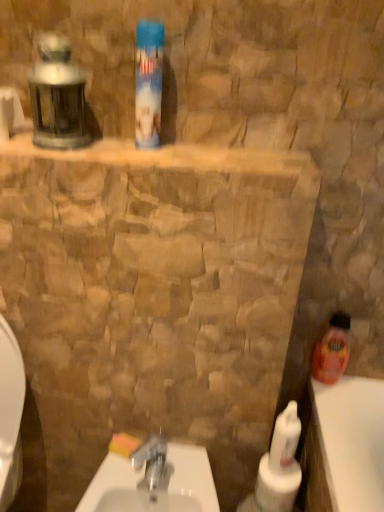
This screenshot has height=512, width=384. I want to click on vacant region to the right of yellow sponge at lower center, so click(x=187, y=468).